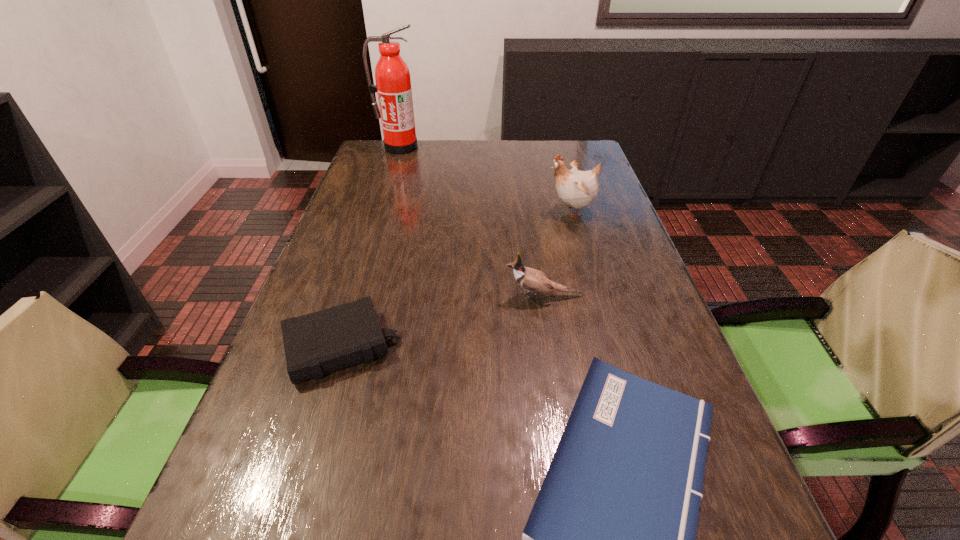
This screenshot has height=540, width=960. In order to click on the farthest object in this screenshot , I will do `click(393, 84)`.

The height and width of the screenshot is (540, 960). I want to click on fire extinguisher, so click(393, 84).

The height and width of the screenshot is (540, 960). I want to click on the second farthest object, so click(575, 188).

The width and height of the screenshot is (960, 540). I want to click on the taller bird, so click(575, 188).

Find the location of `the third tallest object`. the third tallest object is located at coordinates (533, 280).

This screenshot has height=540, width=960. Find the location of `the shorter bird`. the shorter bird is located at coordinates (533, 280).

Where is `Bible`? This screenshot has width=960, height=540. Bible is located at coordinates (328, 340).

The image size is (960, 540). Identify the location of free region located 0.160m on the label side of the tallest object. (390, 177).

Where is `vacant space situated at the beak of the fourth shortest object`? vacant space situated at the beak of the fourth shortest object is located at coordinates (484, 211).

Image resolution: width=960 pixels, height=540 pixels. I want to click on free space located 0.300m at the beak of the fourth shortest object, so click(443, 211).